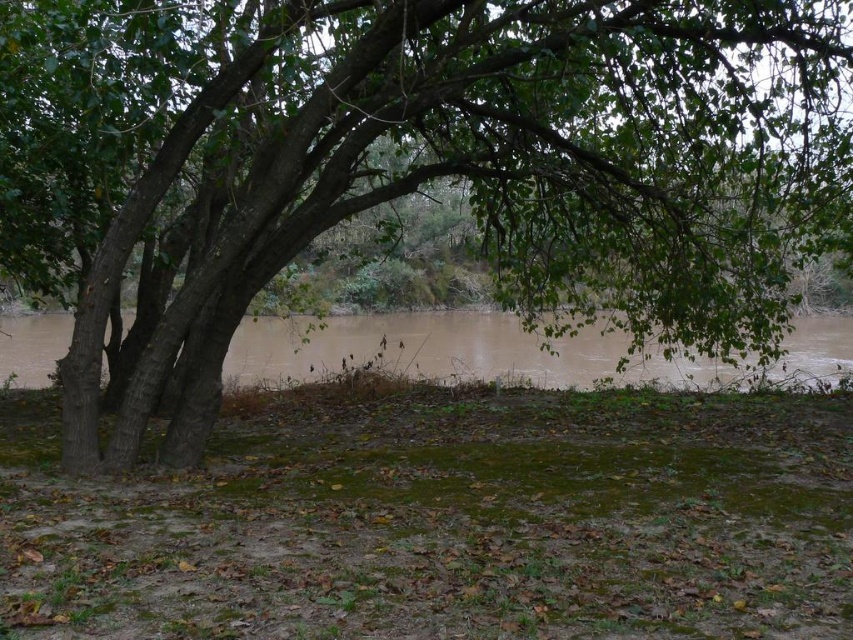
Does green leafy tree at center have a smaller size compared to brown muddy water at center?

Actually, green leafy tree at center might be larger than brown muddy water at center.

Between green leafy tree at center and brown muddy water at center, which one has less height?

brown muddy water at center is shorter.

Who is more distant from viewer, (x=546, y=0) or (x=614, y=342)?

The point (x=614, y=342) is behind.

Image resolution: width=853 pixels, height=640 pixels. Identify the location of green leafy tree at center. (421, 164).